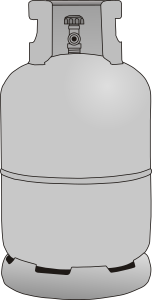
Where is `holder`? holder is located at coordinates (23, 265), (88, 269), (143, 260).